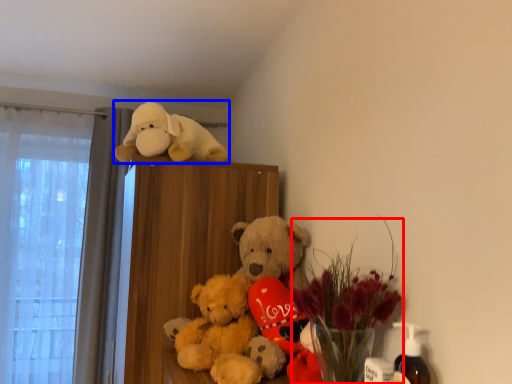
Question: Which object is further to the camera taking this photo, floral arrangement (highlighted by a red box) or toy (highlighted by a blue box)?

Choices:
 (A) floral arrangement
 (B) toy

Answer: (B)